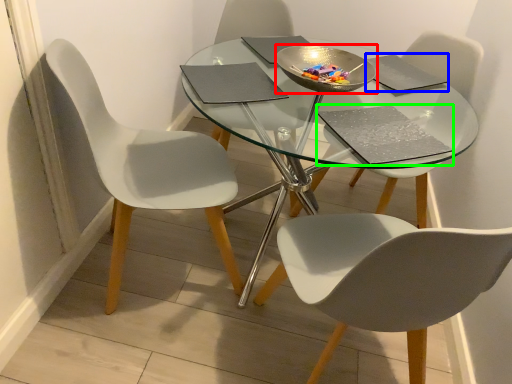
Question: Estimate the real-world distances between objects in this image. Which object is closer to bowl (highlighted by a red box), pad (highlighted by a blue box) or pad (highlighted by a green box)?

Choices:
 (A) pad
 (B) pad

Answer: (A)